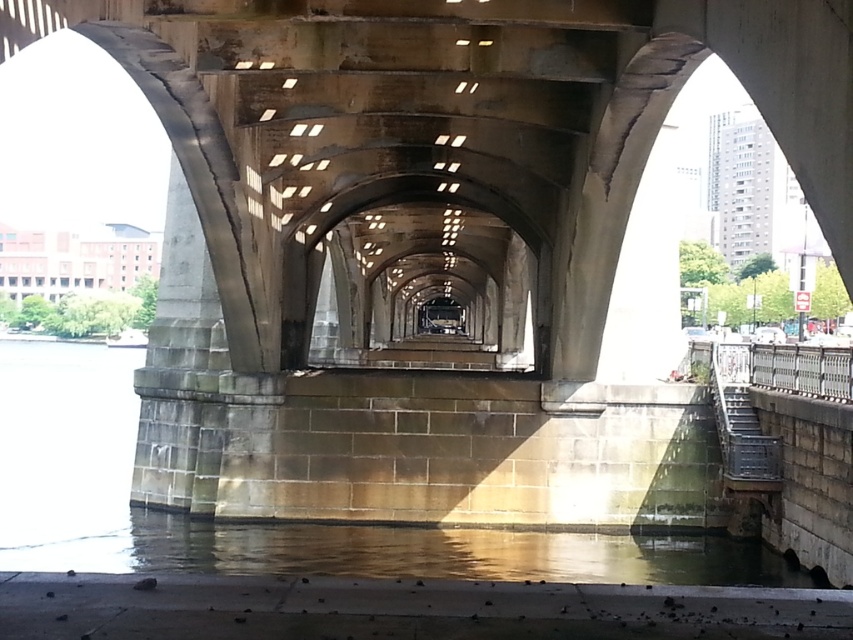
Question: Which object is closer to the camera taking this photo?

Choices:
 (A) clear water at lower center
 (B) gray stone pillar at center

Answer: (A)

Question: Is clear water at lower center positioned in front of gray stone pillar at center?

Choices:
 (A) yes
 (B) no

Answer: (A)

Question: Among these points, which one is farthest from the camera?

Choices:
 (A) tap(187, 339)
 (B) tap(704, 577)

Answer: (A)

Question: Can you confirm if clear water at lower center is positioned to the left of gray stone pillar at center?

Choices:
 (A) yes
 (B) no

Answer: (B)

Question: Does clear water at lower center have a lesser width compared to gray stone pillar at center?

Choices:
 (A) no
 (B) yes

Answer: (A)